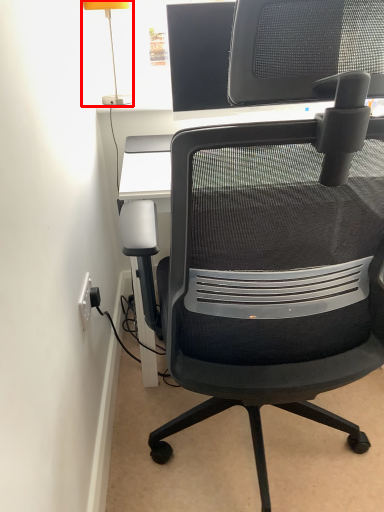
Question: From the image's perspective, where is table lamp (annotated by the red box) located relative to chair?

Choices:
 (A) below
 (B) above

Answer: (B)